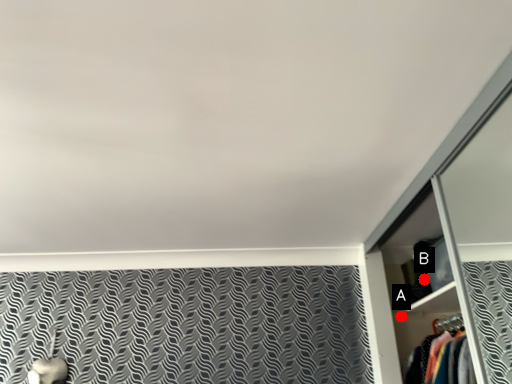
Question: Two points are circled on the image, labeled by A and B beside each circle. Which point is farther from the camera taking this photo?

Choices:
 (A) A is further
 (B) B is further

Answer: (A)